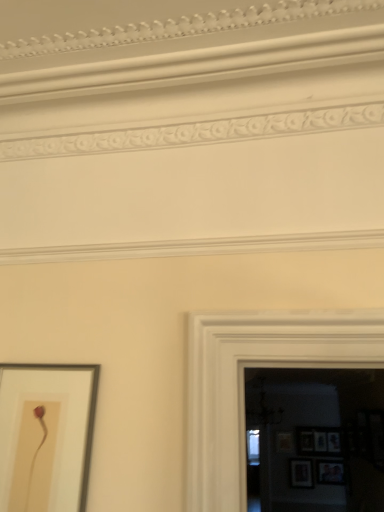
The width and height of the screenshot is (384, 512). Find the location of `wooden picture frame at right, positioned as the 5th picture frame in front-to-back order`. wooden picture frame at right, positioned as the 5th picture frame in front-to-back order is located at coordinates (285, 442).

What do you see at coordinates (285, 442) in the screenshot? This screenshot has width=384, height=512. I see `wooden picture frame at right, the 3th picture frame in the bottom-to-top sequence` at bounding box center [285, 442].

The image size is (384, 512). I want to click on wooden picture frame at lower right, the second picture frame viewed from the back, so click(318, 441).

This screenshot has height=512, width=384. I want to click on wooden picture frame at right, arranged as the 3th picture frame when viewed from the top, so point(285,442).

Considering the relative sizes of wooden picture frame at right, arranged as the 3th picture frame when viewed from the top, and wooden picture frame at lower right, arranged as the 3th picture frame when viewed from the right, in the image provided, is wooden picture frame at right, arranged as the 3th picture frame when viewed from the top, wider than wooden picture frame at lower right, arranged as the 3th picture frame when viewed from the right,?

Yes.

Where is `the 1st picture frame counting from the right of the wooden picture frame at right, the 1th picture frame in the back-to-front sequence`? the 1st picture frame counting from the right of the wooden picture frame at right, the 1th picture frame in the back-to-front sequence is located at coordinates (301, 473).

Does point (286, 451) come farther from viewer compared to point (303, 471)?

Yes, point (286, 451) is behind point (303, 471).

Is matte wooden picture frame at lower right, placed as the fifth picture frame when sorted from left to right, closer to camera compared to wooden picture frame at right, positioned as the 5th picture frame in front-to-back order?

Yes, matte wooden picture frame at lower right, placed as the fifth picture frame when sorted from left to right, is closer to the viewer.

Does matte wooden picture frame at lower right, placed as the fifth picture frame when sorted from left to right, appear on the left side of wooden picture frame at right, the fourth picture frame positioned from the right?

No, matte wooden picture frame at lower right, placed as the fifth picture frame when sorted from left to right, is not to the left of wooden picture frame at right, the fourth picture frame positioned from the right.

From a real-world perspective, is matte wooden picture frame at lower right, placed as the fifth picture frame when sorted from left to right, positioned above or below wooden picture frame at right, the 1th picture frame in the back-to-front sequence?

matte wooden picture frame at lower right, placed as the fifth picture frame when sorted from left to right, is below wooden picture frame at right, the 1th picture frame in the back-to-front sequence.

Is matte wooden picture frame at lower right, acting as the 1th picture frame starting from the right, bigger or smaller than wooden picture frame at right, the 1th picture frame in the back-to-front sequence?

In the image, matte wooden picture frame at lower right, acting as the 1th picture frame starting from the right, appears to be larger than wooden picture frame at right, the 1th picture frame in the back-to-front sequence.

Who is taller, wooden picture frame at lower right, the third picture frame when ordered from back to front, or matte white picture frame at lower left, marked as the first picture frame in a front-to-back arrangement?

matte white picture frame at lower left, marked as the first picture frame in a front-to-back arrangement, is taller.

Between point (290, 479) and point (48, 466), which one is positioned behind?

Point (290, 479)

Where is `the 4th picture frame below the matte white picture frame at lower left, which ranks as the fifth picture frame in bottom-to-top order (from the image's perspective)`? the 4th picture frame below the matte white picture frame at lower left, which ranks as the fifth picture frame in bottom-to-top order (from the image's perspective) is located at coordinates [301, 473].

From the image's perspective, between wooden picture frame at lower right, the third picture frame when ordered from back to front, and matte white picture frame at lower left, which ranks as the fifth picture frame in bottom-to-top order, who is located below?

From the image's view, wooden picture frame at lower right, the third picture frame when ordered from back to front, is below.

From a real-world perspective, is wooden picture frame at right, the 1th picture frame in the back-to-front sequence, below matte white picture frame at lower left, which is counted as the fifth picture frame, starting from the back?

Yes, from a real-world perspective, wooden picture frame at right, the 1th picture frame in the back-to-front sequence, is below matte white picture frame at lower left, which is counted as the fifth picture frame, starting from the back.

From the image's perspective, who appears lower, wooden picture frame at right, the 1th picture frame in the back-to-front sequence, or matte white picture frame at lower left, which ranks as the fifth picture frame in bottom-to-top order?

From the image's view, wooden picture frame at right, the 1th picture frame in the back-to-front sequence, is below.

Is matte white picture frame at lower left, which ranks as the fifth picture frame in bottom-to-top order, at the back of wooden picture frame at right, the fourth picture frame positioned from the right?

No.

Which of these two, wooden picture frame at right, positioned as the second picture frame in left-to-right order, or matte white picture frame at lower left, which ranks as the fifth picture frame in bottom-to-top order, is smaller?

matte white picture frame at lower left, which ranks as the fifth picture frame in bottom-to-top order.

Is wooden picture frame at lower right, the fourth picture frame from the front, taller or shorter than matte white picture frame at lower left, the first picture frame from the top?

Clearly, wooden picture frame at lower right, the fourth picture frame from the front, is shorter compared to matte white picture frame at lower left, the first picture frame from the top.

Does point (319, 443) lie in front of point (53, 499)?

No, (319, 443) is behind (53, 499).

Considering the sizes of wooden picture frame at lower right, which is the 4th picture frame in left-to-right order, and matte white picture frame at lower left, which ranks as the fifth picture frame in bottom-to-top order, in the image, is wooden picture frame at lower right, which is the 4th picture frame in left-to-right order, bigger or smaller than matte white picture frame at lower left, which ranks as the fifth picture frame in bottom-to-top order,?

Clearly, wooden picture frame at lower right, which is the 4th picture frame in left-to-right order, is larger in size than matte white picture frame at lower left, which ranks as the fifth picture frame in bottom-to-top order.

Based on their positions, is wooden picture frame at lower right, the fourth picture frame from the front, located to the left or right of matte white picture frame at lower left, the first picture frame from the top?

Based on their positions, wooden picture frame at lower right, the fourth picture frame from the front, is located to the right of matte white picture frame at lower left, the first picture frame from the top.

From a real-world perspective, is wooden picture frame at lower right, the 1th picture frame positioned from the bottom, above or below wooden picture frame at lower right, the second picture frame viewed from the top?

In terms of real-world spatial position, wooden picture frame at lower right, the 1th picture frame positioned from the bottom, is below wooden picture frame at lower right, the second picture frame viewed from the top.

How different are the orientations of wooden picture frame at lower right, the third picture frame when ordered from back to front, and wooden picture frame at lower right, the second picture frame viewed from the back, in degrees?

The facing directions of wooden picture frame at lower right, the third picture frame when ordered from back to front, and wooden picture frame at lower right, the second picture frame viewed from the back, are 0.0177 degrees apart.

Looking at their sizes, would you say wooden picture frame at lower right, the third picture frame when ordered from back to front, is wider or thinner than wooden picture frame at lower right, which is the 4th picture frame in left-to-right order?

Considering their sizes, wooden picture frame at lower right, the third picture frame when ordered from back to front, looks slimmer than wooden picture frame at lower right, which is the 4th picture frame in left-to-right order.

Which object is thinner, wooden picture frame at lower right, the second picture frame viewed from the back, or wooden picture frame at lower right, the fifth picture frame viewed from the top?

wooden picture frame at lower right, the fifth picture frame viewed from the top, is thinner.

From a real-world perspective, which object stands above the other?

wooden picture frame at lower right, placed as the second picture frame when sorted from right to left, from a real-world perspective.

Could you tell me if wooden picture frame at lower right, the second picture frame viewed from the back, is turned towards wooden picture frame at lower right, acting as the 3th picture frame starting from the front?

No, wooden picture frame at lower right, the second picture frame viewed from the back, is not oriented towards wooden picture frame at lower right, acting as the 3th picture frame starting from the front.

From the picture: Does wooden picture frame at lower right, which is the 4th picture frame in left-to-right order, touch wooden picture frame at lower right, arranged as the 3th picture frame when viewed from the right?

wooden picture frame at lower right, which is the 4th picture frame in left-to-right order, and wooden picture frame at lower right, arranged as the 3th picture frame when viewed from the right, are clearly separated.

Find the location of a particular element. The width and height of the screenshot is (384, 512). the 1st picture frame located beneath the wooden picture frame at right, the 3th picture frame in the bottom-to-top sequence (from a real-world perspective) is located at coordinates (301, 473).

Find the location of a particular element. This screenshot has width=384, height=512. picture frame that is the 1st one when counting downward from the wooden picture frame at right, the 3th picture frame in the bottom-to-top sequence (from the image's perspective) is located at coordinates (330, 472).

Estimate the real-world distances between objects in this image. Which object is closer to matte wooden picture frame at lower right, the second picture frame from the front, wooden picture frame at right, positioned as the 5th picture frame in front-to-back order, or wooden picture frame at lower right, acting as the 3th picture frame starting from the front?

wooden picture frame at lower right, acting as the 3th picture frame starting from the front, is closer to matte wooden picture frame at lower right, the second picture frame from the front.

Considering their positions, is wooden picture frame at lower right, the second picture frame viewed from the back, positioned further to wooden picture frame at lower right, the third picture frame from the left, than matte wooden picture frame at lower right, placed as the fifth picture frame when sorted from left to right?

wooden picture frame at lower right, the second picture frame viewed from the back.

Considering their positions, is wooden picture frame at lower right, placed as the second picture frame when sorted from right to left, positioned further to matte white picture frame at lower left, the first picture frame from the top, than matte wooden picture frame at lower right, which is the 4th picture frame from back to front?

Based on the image, matte wooden picture frame at lower right, which is the 4th picture frame from back to front, appears to be further to matte white picture frame at lower left, the first picture frame from the top.

From the image, which object appears to be farther from wooden picture frame at lower right, the second picture frame viewed from the top, wooden picture frame at right, the 1th picture frame in the back-to-front sequence, or wooden picture frame at lower right, the 1th picture frame positioned from the bottom?

wooden picture frame at lower right, the 1th picture frame positioned from the bottom.

Estimate the real-world distances between objects in this image. Which object is closer to wooden picture frame at lower right, the fourth picture frame from the front, matte wooden picture frame at lower right, placed as the fifth picture frame when sorted from left to right, or wooden picture frame at lower right, acting as the 3th picture frame starting from the front?

matte wooden picture frame at lower right, placed as the fifth picture frame when sorted from left to right, is positioned closer to the anchor wooden picture frame at lower right, the fourth picture frame from the front.

Looking at the image, which one is located further to matte white picture frame at lower left, which ranks as the fifth picture frame in bottom-to-top order, wooden picture frame at right, positioned as the 5th picture frame in front-to-back order, or wooden picture frame at lower right, the third picture frame when ordered from back to front?

wooden picture frame at lower right, the third picture frame when ordered from back to front, is positioned further to the anchor matte white picture frame at lower left, which ranks as the fifth picture frame in bottom-to-top order.

When comparing their distances from matte wooden picture frame at lower right, which is the 4th picture frame from back to front, does wooden picture frame at lower right, which is the 4th picture frame in left-to-right order, or wooden picture frame at lower right, acting as the 3th picture frame starting from the front, seem closer?

The object closer to matte wooden picture frame at lower right, which is the 4th picture frame from back to front, is wooden picture frame at lower right, acting as the 3th picture frame starting from the front.

Based on their spatial positions, is wooden picture frame at lower right, acting as the 3th picture frame starting from the front, or matte white picture frame at lower left, marked as the first picture frame in a front-to-back arrangement, closer to matte wooden picture frame at lower right, placed as the fifth picture frame when sorted from left to right?

Among the two, wooden picture frame at lower right, acting as the 3th picture frame starting from the front, is located nearer to matte wooden picture frame at lower right, placed as the fifth picture frame when sorted from left to right.

The image size is (384, 512). Find the location of `picture frame situated between wooden picture frame at right, the 3th picture frame in the bottom-to-top sequence, and wooden picture frame at lower right, the fourth picture frame from the front, from left to right`. picture frame situated between wooden picture frame at right, the 3th picture frame in the bottom-to-top sequence, and wooden picture frame at lower right, the fourth picture frame from the front, from left to right is located at coordinates (301, 473).

Locate an element on the screen. This screenshot has height=512, width=384. picture frame located between matte white picture frame at lower left, which is counted as the 1th picture frame, starting from the left, and wooden picture frame at lower right, arranged as the 3th picture frame when viewed from the right, in the depth direction is located at coordinates (330, 472).

At what (x,y) coordinates should I click in order to perform the action: click on picture frame between wooden picture frame at lower right, acting as the 3th picture frame starting from the front, and matte wooden picture frame at lower right, the 2th picture frame positioned from the bottom, from left to right. Please return your answer as a coordinate pair (x, y). This screenshot has height=512, width=384. Looking at the image, I should click on (318, 441).